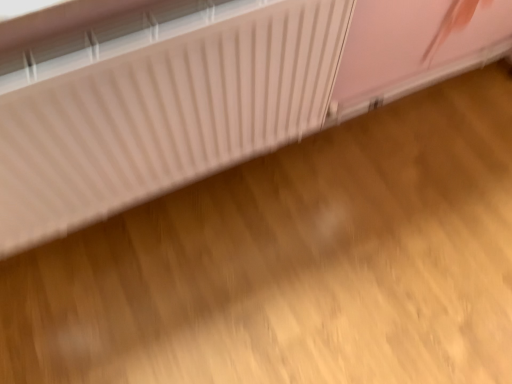
I want to click on vacant space to the right of white matte radiator at upper left, so click(410, 178).